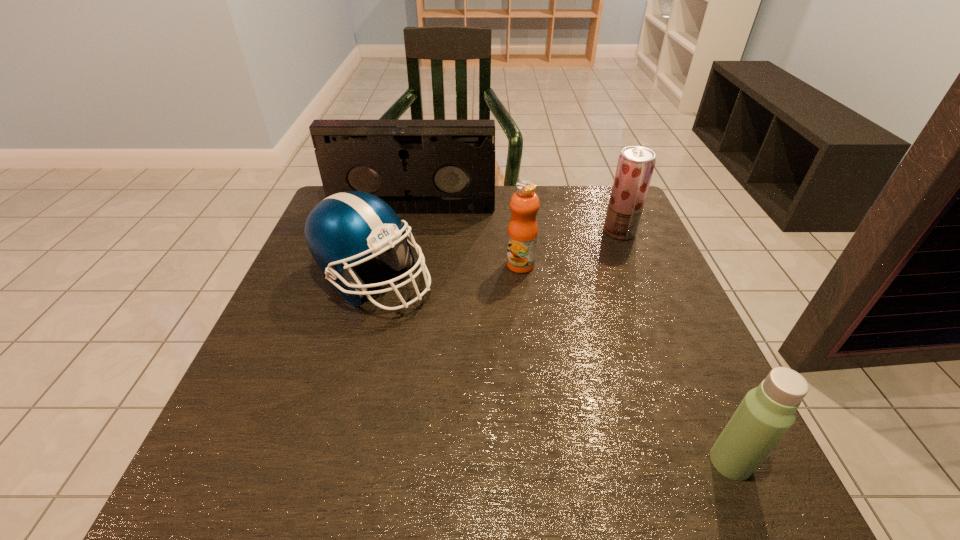
Image resolution: width=960 pixels, height=540 pixels. Identify the location of vacant space located at the front of the football helmet with the faceguard. (515, 281).

At what (x,y) coordinates should I click in order to perform the action: click on vacant space located 0.180m on the back of the nearest object. Please return your answer as a coordinate pair (x, y). The height and width of the screenshot is (540, 960). Looking at the image, I should click on (683, 353).

This screenshot has width=960, height=540. In order to click on videotape present at the far edge in this screenshot , I will do `click(416, 166)`.

This screenshot has width=960, height=540. I want to click on fruit juice that is at the far edge, so click(x=635, y=166).

Identify the location of object that is at the near edge. (767, 412).

This screenshot has width=960, height=540. In order to click on videotape that is at the left edge in this screenshot , I will do `click(416, 166)`.

Identify the location of football helmet located at the left edge. (342, 230).

Locate an element on the screen. This screenshot has height=540, width=960. fruit juice positioned at the right edge is located at coordinates (635, 166).

At what (x,y) coordinates should I click in order to perform the action: click on thermos bottle at the right edge. Please return your answer as a coordinate pair (x, y). Looking at the image, I should click on (767, 412).

Where is `object at the far left corner`? Image resolution: width=960 pixels, height=540 pixels. object at the far left corner is located at coordinates (416, 166).